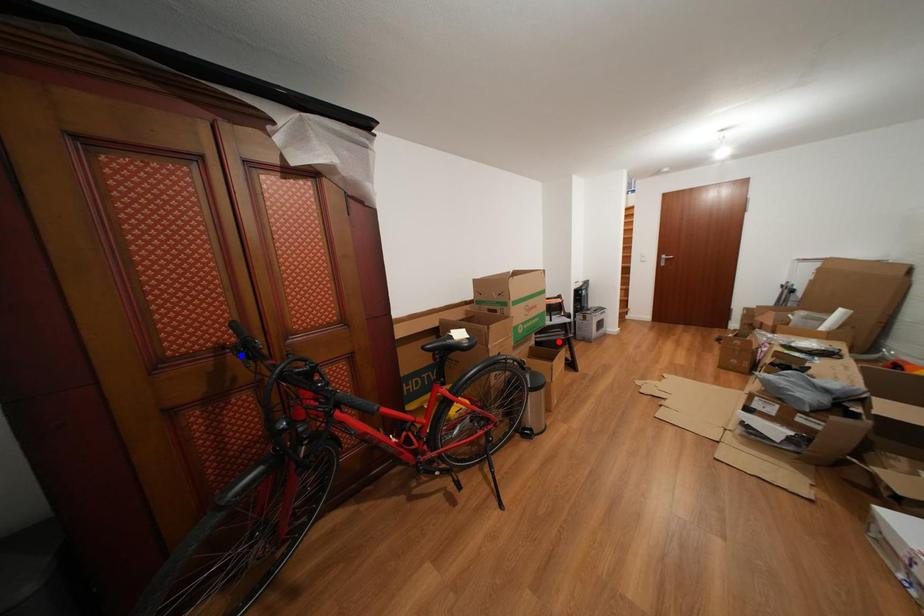
Question: Which of the two points in the image is closer to the camera?

Choices:
 (A) Blue point is closer.
 (B) Red point is closer.

Answer: (A)